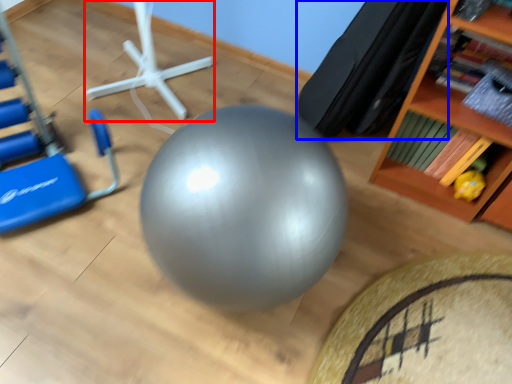
Question: Which point is further to the camera, sport equipment (highlighted by a red box) or bean bag chair (highlighted by a blue box)?

Choices:
 (A) sport equipment
 (B) bean bag chair

Answer: (A)